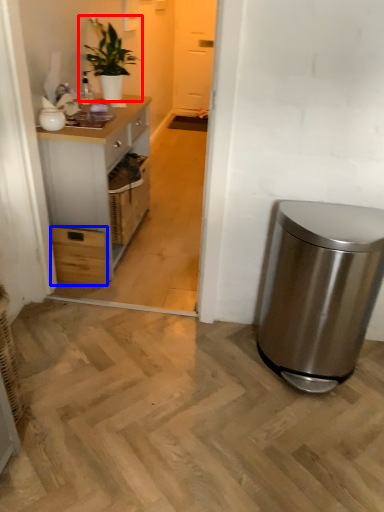
Question: Among these objects, which one is nearest to the camera, houseplant (highlighted by a red box) or drawer (highlighted by a blue box)?

Choices:
 (A) houseplant
 (B) drawer

Answer: (B)